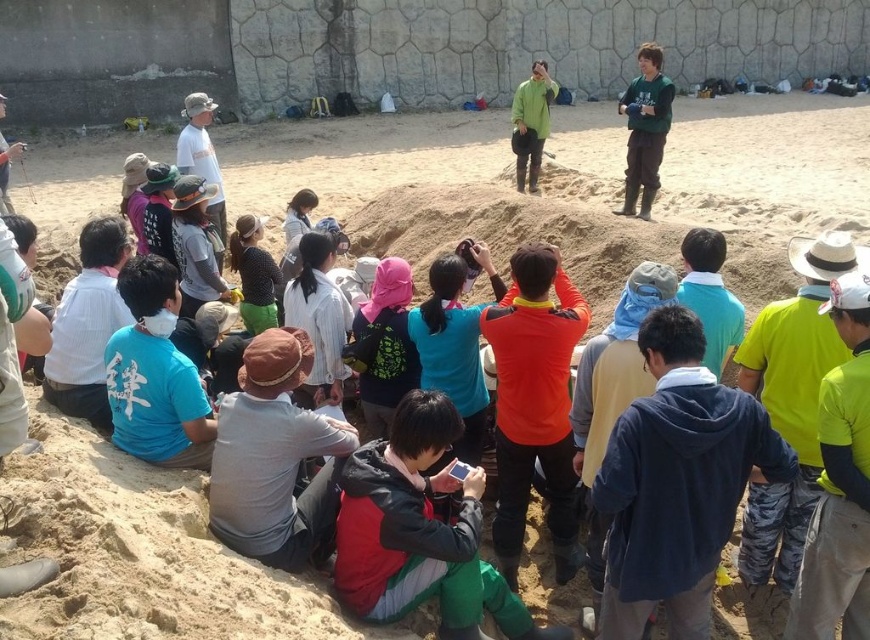
Is green matte jacket at upper right above green matte jacket at center?

Yes.

Measure the distance between green matte jacket at upper right and camera.

green matte jacket at upper right and camera are 14.62 meters apart.

Is point (661, 140) in front of point (527, 145)?

Yes, it is in front of point (527, 145).

Find the location of a particular element. The height and width of the screenshot is (640, 870). green matte jacket at upper right is located at coordinates (646, 129).

Which is more to the left, reddish-orange hoodie at center or green matte jacket at center?

reddish-orange hoodie at center is more to the left.

In the scene shown: Can you confirm if reddish-orange hoodie at center is positioned to the right of green matte jacket at center?

In fact, reddish-orange hoodie at center is to the left of green matte jacket at center.

Does point (343, 520) come farther from viewer compared to point (531, 96)?

No, (343, 520) is closer to viewer.

This screenshot has height=640, width=870. I want to click on reddish-orange hoodie at center, so click(420, 531).

Who is lower down, reddish-orange hoodie at center or green matte jacket at upper right?

reddish-orange hoodie at center is lower down.

Can you confirm if reddish-orange hoodie at center is shorter than green matte jacket at upper right?

Yes, reddish-orange hoodie at center is shorter than green matte jacket at upper right.

Which is in front, point (400, 429) or point (636, 81)?

Point (400, 429) is in front.

Locate an element on the screen. This screenshot has height=640, width=870. reddish-orange hoodie at center is located at coordinates (420, 531).